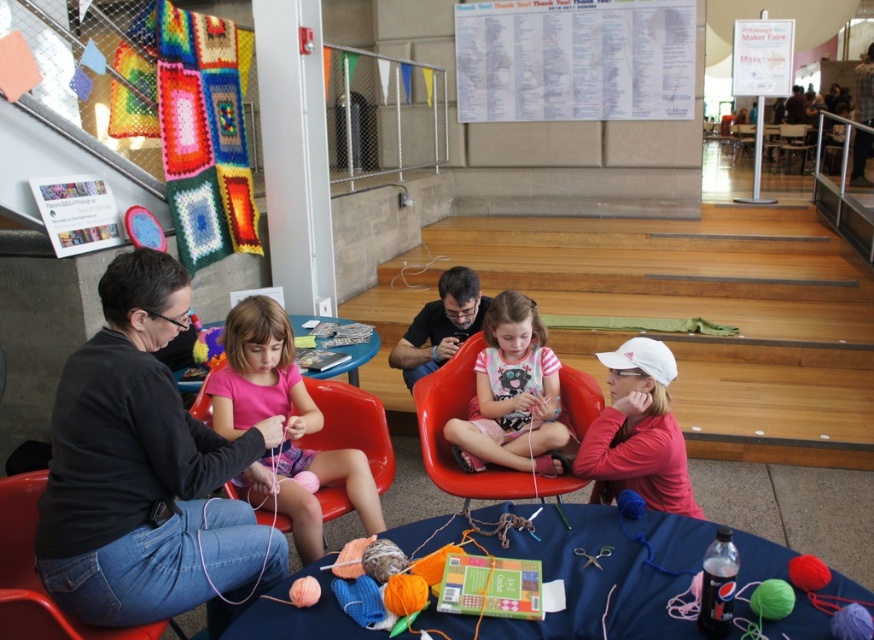
Between pink fabric dress at center and matte plastic chair at center, which one appears on the left side from the viewer's perspective?

matte plastic chair at center is more to the left.

Between pink fabric dress at center and matte plastic chair at center, which one has less height?

matte plastic chair at center

Which is in front, point (483, 369) or point (559, 493)?

Point (559, 493) is more forward.

This screenshot has height=640, width=874. In order to click on pink fabric dress at center in this screenshot , I will do `click(512, 394)`.

Is pink fabric at center thinner than matte plastic chair at lower left?

Incorrect, pink fabric at center's width is not less than matte plastic chair at lower left's.

From the picture: Does pink fabric at center appear on the left side of matte plastic chair at lower left?

Incorrect, pink fabric at center is not on the left side of matte plastic chair at lower left.

Where is `pink fabric at center`? The width and height of the screenshot is (874, 640). pink fabric at center is located at coordinates (285, 424).

Which is above, pink fabric dress at center or matte plastic chair at lower left?

pink fabric dress at center is above.

Is pink fabric dress at center above matte plastic chair at lower left?

Yes.

Locate an element on the screen. This screenshot has width=874, height=640. pink fabric dress at center is located at coordinates (512, 394).